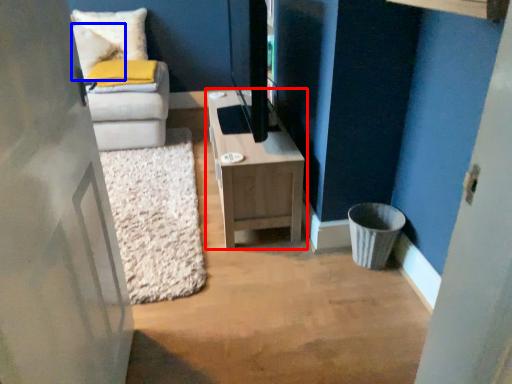
Question: Which object appears farthest to the camera in this image, table (highlighted by a red box) or pillow (highlighted by a blue box)?

Choices:
 (A) table
 (B) pillow

Answer: (B)